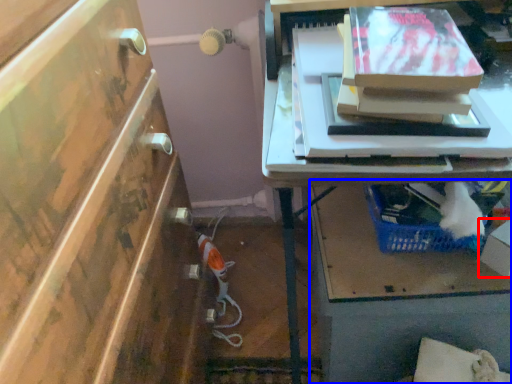
Question: Which point is closer to the camera, box (highlighted by a red box) or vanity (highlighted by a blue box)?

Choices:
 (A) box
 (B) vanity

Answer: (A)